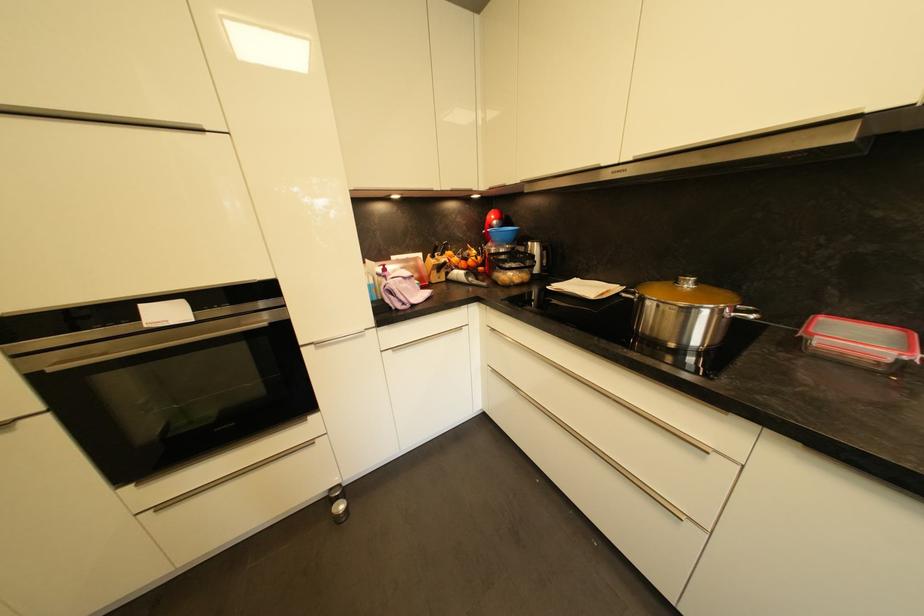
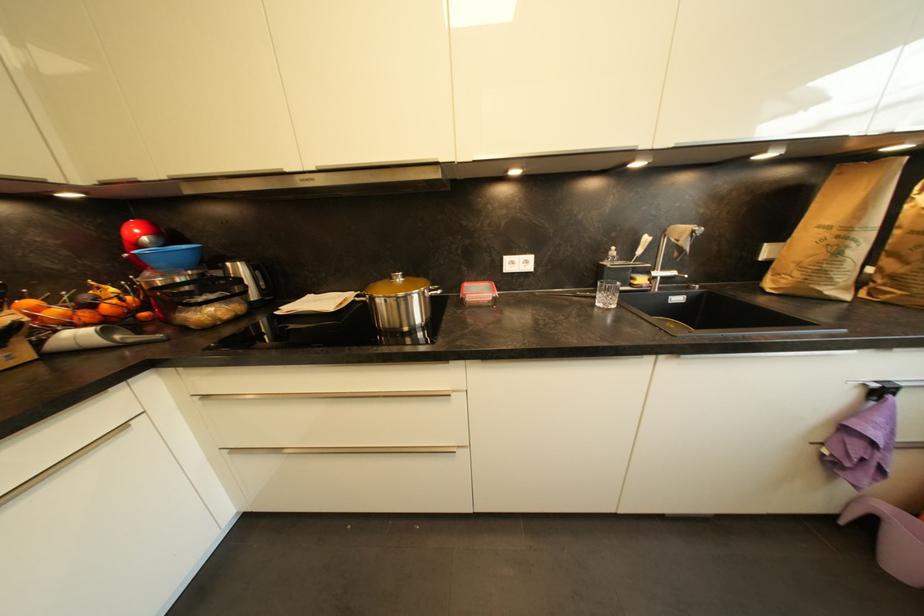
Question: The camera is either moving clockwise (left) or counter-clockwise (right) around the object. The first image is from the beginning of the video and the second image is from the end. Is the camera moving left or right when shooting the video?

Choices:
 (A) Left
 (B) Right

Answer: (A)